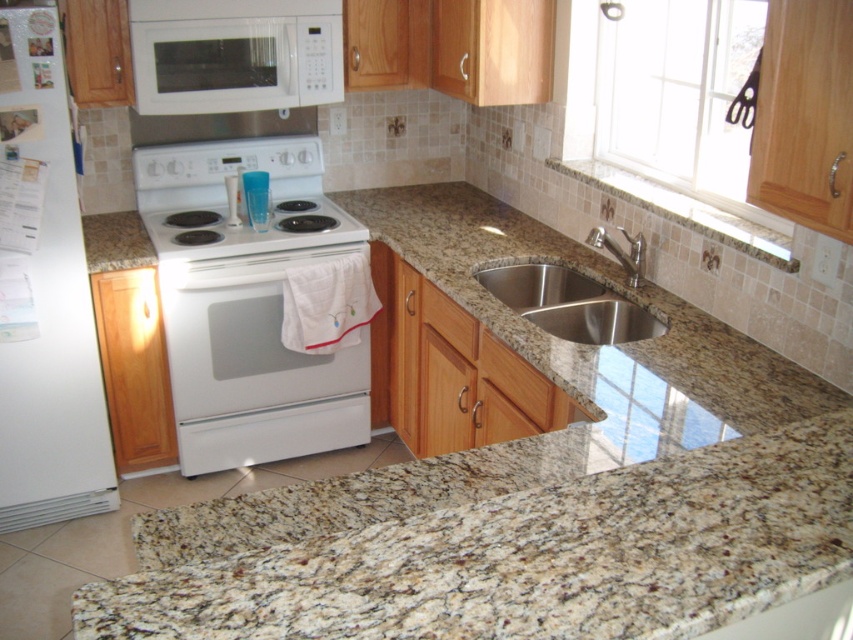
Question: Which of the following is the farthest from the observer?

Choices:
 (A) (280, 221)
 (B) (163, 141)
 (C) (138, 10)
 (D) (628, 241)

Answer: (B)

Question: Is white matte refrigerator at left to the left of white glossy electric stove at center from the viewer's perspective?

Choices:
 (A) yes
 (B) no

Answer: (A)

Question: Which object appears farthest from the camera in this image?

Choices:
 (A) silver metallic faucet at sink right
 (B) white glossy exhaust hood at upper center
 (C) white glossy oven at center
 (D) stainless steel sink at lower center

Answer: (B)

Question: Does white matte refrigerator at left have a lesser width compared to white glossy exhaust hood at upper center?

Choices:
 (A) yes
 (B) no

Answer: (A)

Question: Which point is farther to the camera?

Choices:
 (A) white glossy oven at center
 (B) white glossy electric stove at center

Answer: (A)

Question: Does white matte microwave at upper center have a larger size compared to white glossy electric stove at center?

Choices:
 (A) yes
 (B) no

Answer: (B)